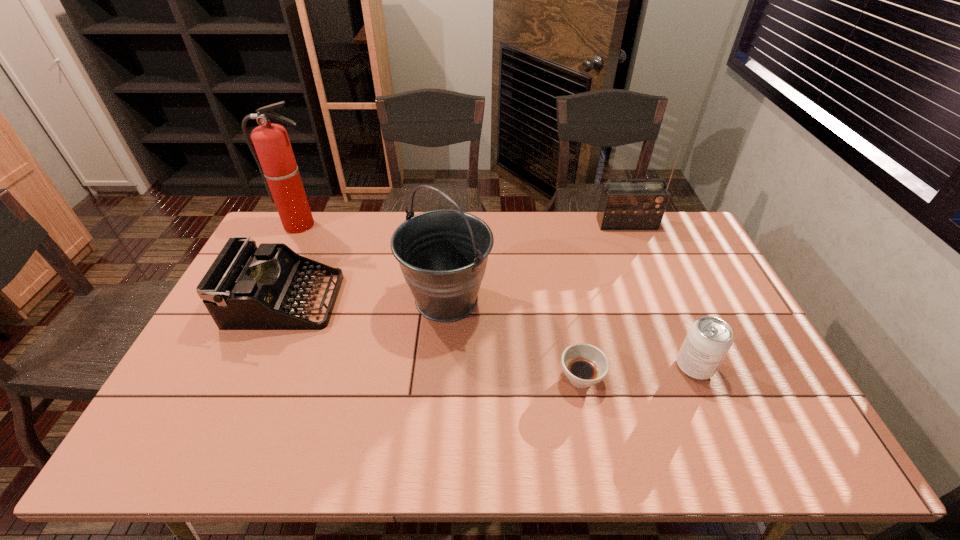
Find the location of a particular element. The width and height of the screenshot is (960, 540). free space located 0.060m on the front panel of the third tallest object is located at coordinates (634, 241).

Locate an element on the screen. This screenshot has width=960, height=540. vacant space located on the typing side of the typewriter is located at coordinates (410, 301).

Locate an element on the screen. free space located 0.140m on the right of the soda can is located at coordinates (765, 367).

Locate an element on the screen. This screenshot has width=960, height=540. vacant space located 0.110m on the right of the soup bowl is located at coordinates (645, 378).

You are a GUI agent. You are given a task and a screenshot of the screen. Output one action in this format:
    pyautogui.click(x=<x>, y=<y>)
    Task: Click on the fire extinguisher that is positioned at the far edge
    This screenshot has height=540, width=960.
    Given the screenshot: What is the action you would take?
    pyautogui.click(x=274, y=156)

Find the location of a particular element. radio receiver positioned at the far edge is located at coordinates (623, 205).

Locate an element on the screen. The width and height of the screenshot is (960, 540). fire extinguisher that is at the left edge is located at coordinates (274, 156).

Locate an element on the screen. The image size is (960, 540). typewriter at the left edge is located at coordinates (246, 288).

Find the location of a particular element. The image size is (960, 540). radio receiver situated at the right edge is located at coordinates click(x=623, y=205).

The height and width of the screenshot is (540, 960). Find the location of `soda can at the right edge`. soda can at the right edge is located at coordinates (709, 339).